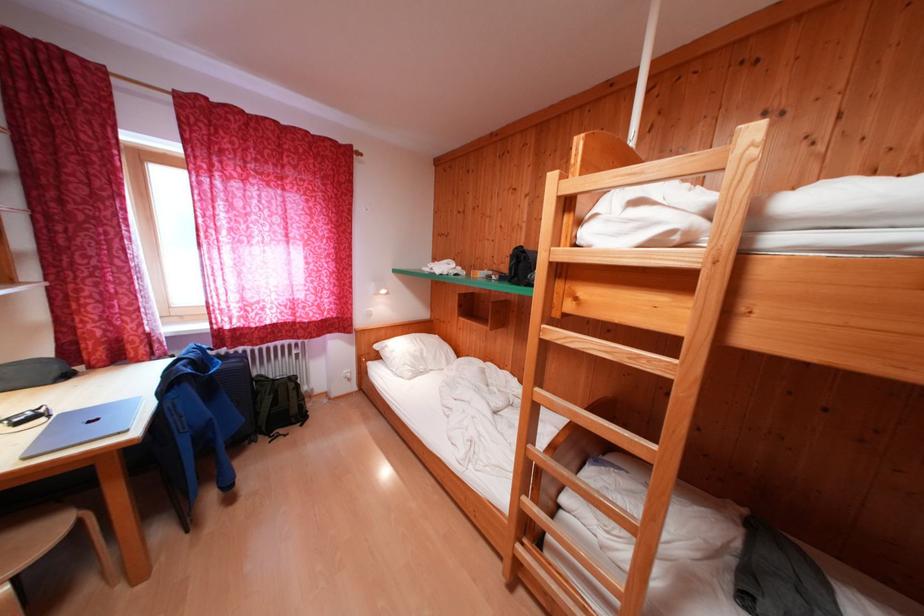
Find the location of `green backpack`. green backpack is located at coordinates (277, 403).